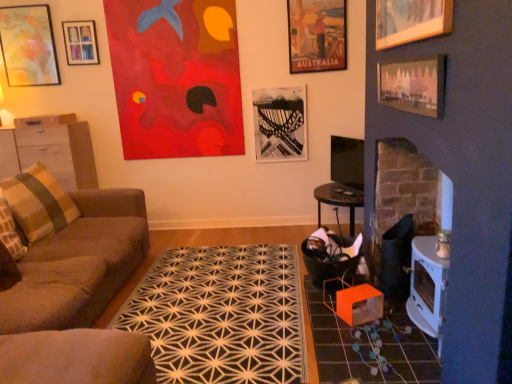
Measure the distance between black glossy tv at center and camera.

black glossy tv at center and camera are 3.67 meters apart from each other.

The height and width of the screenshot is (384, 512). What do you see at coordinates (221, 315) in the screenshot? I see `black geometric rug at center` at bounding box center [221, 315].

Describe the element at coordinates (28, 46) in the screenshot. I see `matte wooden picture frame at upper left, positioned as the third picture frame in back-to-front order` at that location.

What are the coordinates of `black and white photograph at center, the sixth picture frame in the front-to-back sequence` in the screenshot? It's located at (x=280, y=123).

This screenshot has width=512, height=384. Identify the location of pink paper picture frame at upper right, which ranks as the sixth picture frame in left-to-right order. (414, 85).

From the image's perspective, which one is positioned lower, black glossy tv at center or orange cardboard box at lower right?

orange cardboard box at lower right, from the image's perspective.

Does black glossy tv at center touch orange cardboard box at lower right?

No, black glossy tv at center is not beside orange cardboard box at lower right.

In terms of size, does black glossy tv at center appear bigger or smaller than orange cardboard box at lower right?

black glossy tv at center is smaller than orange cardboard box at lower right.

Based on the photo, does black glossy tv at center contain orange cardboard box at lower right?

That's incorrect, orange cardboard box at lower right is not inside black glossy tv at center.

Between matte paper poster at upper center, which appears as the third picture frame when viewed from the right, and black and white photograph at center, the third picture frame when ordered from left to right, which one is positioned in front?

matte paper poster at upper center, which appears as the third picture frame when viewed from the right, is more forward.

From a real-world perspective, is matte paper poster at upper center, which appears as the 4th picture frame when viewed from the left, beneath black and white photograph at center, the third picture frame when ordered from left to right?

Incorrect, from a real-world perspective, matte paper poster at upper center, which appears as the 4th picture frame when viewed from the left, is higher than black and white photograph at center, the third picture frame when ordered from left to right.

Locate an element on the screen. The image size is (512, 384). the 1st picture frame to the left of the matte paper poster at upper center, the 4th picture frame positioned from the back, starting your count from the anchor is located at coordinates click(x=280, y=123).

Is matte paper poster at upper center, which is the 3th picture frame in front-to-back order, aimed at black and white photograph at center, which is the 1th picture frame in back-to-front order?

No, matte paper poster at upper center, which is the 3th picture frame in front-to-back order, is not aimed at black and white photograph at center, which is the 1th picture frame in back-to-front order.

Based on the photo, which object is positioned more to the left, orange cardboard box at lower right or black and white photograph at center, the sixth picture frame in the front-to-back sequence?

From the viewer's perspective, black and white photograph at center, the sixth picture frame in the front-to-back sequence, appears more on the left side.

Who is smaller, orange cardboard box at lower right or black and white photograph at center, which is the 1th picture frame in back-to-front order?

black and white photograph at center, which is the 1th picture frame in back-to-front order, is smaller.

Between orange cardboard box at lower right and black and white photograph at center, the third picture frame when ordered from left to right, which one has more height?

Standing taller between the two is black and white photograph at center, the third picture frame when ordered from left to right.

Is black and white photograph at center, the third picture frame when ordered from left to right, located within orange cardboard box at lower right?

No, black and white photograph at center, the third picture frame when ordered from left to right, is not inside orange cardboard box at lower right.

From the image's perspective, is black and white photograph at center, the sixth picture frame in the front-to-back sequence, beneath brown wood cabinet at left?

No, from the image's perspective, black and white photograph at center, the sixth picture frame in the front-to-back sequence, is not below brown wood cabinet at left.

Can you confirm if black and white photograph at center, which is the 1th picture frame in back-to-front order, is positioned to the right of brown wood cabinet at left?

Indeed, black and white photograph at center, which is the 1th picture frame in back-to-front order, is positioned on the right side of brown wood cabinet at left.

Is black and white photograph at center, which is the 1th picture frame in back-to-front order, next to brown wood cabinet at left and touching it?

They are not placed beside each other.

Which of these two, wooden picture frame at upper right, the 1th picture frame positioned from the front, or black and white photograph at center, the third picture frame when ordered from left to right, is thinner?

With smaller width is wooden picture frame at upper right, the 1th picture frame positioned from the front.

From the picture: From a real-world perspective, is wooden picture frame at upper right, the fifth picture frame when ordered from left to right, positioned above or below black and white photograph at center, which is the 1th picture frame in back-to-front order?

wooden picture frame at upper right, the fifth picture frame when ordered from left to right, is situated higher than black and white photograph at center, which is the 1th picture frame in back-to-front order, in the real world.

Are wooden picture frame at upper right, which ranks as the 6th picture frame in back-to-front order, and black and white photograph at center, the sixth picture frame in the front-to-back sequence, far apart?

wooden picture frame at upper right, which ranks as the 6th picture frame in back-to-front order, is far away from black and white photograph at center, the sixth picture frame in the front-to-back sequence.

Based on the photo, which of these two, wooden picture frame at upper right, the second picture frame positioned from the right, or black and white photograph at center, the fourth picture frame from the right, stands shorter?

With less height is wooden picture frame at upper right, the second picture frame positioned from the right.

From the picture: From a real-world perspective, which object rests below the other?

From a 3D spatial view, wooden drawer at left is below.

Who is bigger, metallic silver picture frame at upper left, the fifth picture frame in the right-to-left sequence, or wooden drawer at left?

wooden drawer at left is bigger.

In the image, is metallic silver picture frame at upper left, acting as the 5th picture frame starting from the front, on the left side or the right side of wooden drawer at left?

metallic silver picture frame at upper left, acting as the 5th picture frame starting from the front, is positioned on wooden drawer at left's right side.

Is plaid fabric pillow at left in front of brown wood cabinet at left?

Yes, plaid fabric pillow at left is in front of brown wood cabinet at left.

Is plaid fabric pillow at left looking in the opposite direction of brown wood cabinet at left?

No, plaid fabric pillow at left is not facing the opposite direction of brown wood cabinet at left.

Can you confirm if plaid fabric pillow at left is bigger than brown wood cabinet at left?

Incorrect, plaid fabric pillow at left is not larger than brown wood cabinet at left.

The height and width of the screenshot is (384, 512). What are the coordinates of `television lying on the right of orange cardboard box at lower right` in the screenshot? It's located at (347, 162).

Which picture frame is the 3rd one when counting from the front of the black and white photograph at center, which is the 1th picture frame in back-to-front order? Please provide its 2D coordinates.

[(317, 35)]

When comparing their distances from matte paper poster at upper center, the 4th picture frame positioned from the back, does wooden picture frame at upper right, the 1th picture frame positioned from the front, or pink paper picture frame at upper right, which appears as the fifth picture frame when viewed from the back, seem closer?

wooden picture frame at upper right, the 1th picture frame positioned from the front.

In the scene shown: Based on their spatial positions, is matte paper poster at upper center, which is the 3th picture frame in front-to-back order, or plaid fabric pillow at left further from brown fabric couch at left?

Among the two, matte paper poster at upper center, which is the 3th picture frame in front-to-back order, is located further to brown fabric couch at left.

Considering their positions, is plaid fabric pillow at left positioned further to black and white photograph at center, which is the 1th picture frame in back-to-front order, than brown wood cabinet at left?

Based on the image, plaid fabric pillow at left appears to be further to black and white photograph at center, which is the 1th picture frame in back-to-front order.

Which object lies further to the anchor point orange cardboard box at lower right, wooden picture frame at upper right, which ranks as the 6th picture frame in back-to-front order, or matte wooden picture frame at upper left, the 4th picture frame from the front?

matte wooden picture frame at upper left, the 4th picture frame from the front, is positioned further to the anchor orange cardboard box at lower right.

Based on the photo, which object lies nearer to the anchor point matte paper poster at upper center, the 4th picture frame positioned from the back, wooden drawer at left or metallic silver picture frame at upper left, the 2th picture frame viewed from the left?

Among the two, metallic silver picture frame at upper left, the 2th picture frame viewed from the left, is located nearer to matte paper poster at upper center, the 4th picture frame positioned from the back.

Looking at this image, based on their spatial positions, is pink paper picture frame at upper right, which is the 2th picture frame from front to back, or black geometric rug at center further from orange cardboard box at lower right?

Among the two, pink paper picture frame at upper right, which is the 2th picture frame from front to back, is located further to orange cardboard box at lower right.

Estimate the real-world distances between objects in this image. Which object is further from wooden picture frame at upper right, which ranks as the 6th picture frame in back-to-front order, wooden drawer at left or matte paper poster at upper center, the 4th picture frame positioned from the back?

The object further to wooden picture frame at upper right, which ranks as the 6th picture frame in back-to-front order, is wooden drawer at left.

When comparing their distances from black and white photograph at center, the fourth picture frame from the right, does metallic silver picture frame at upper left, acting as the 5th picture frame starting from the front, or black geometric rug at center seem further?

metallic silver picture frame at upper left, acting as the 5th picture frame starting from the front, is positioned further to the anchor black and white photograph at center, the fourth picture frame from the right.

This screenshot has height=384, width=512. In order to click on studio couch situated between wooden drawer at left and black glossy tv at center from left to right in this screenshot , I will do `click(71, 252)`.

This screenshot has height=384, width=512. What are the coordinates of `mat between wooden drawer at left and orange cardboard box at lower right from left to right` in the screenshot? It's located at (221, 315).

The image size is (512, 384). I want to click on studio couch between brown wood cabinet at left and pink paper picture frame at upper right, arranged as the first picture frame when viewed from the right, so click(x=71, y=252).

Find the location of `studio couch located between plaid fabric pillow at left and orange cardboard box at lower right in the left-right direction`. studio couch located between plaid fabric pillow at left and orange cardboard box at lower right in the left-right direction is located at coordinates (71, 252).